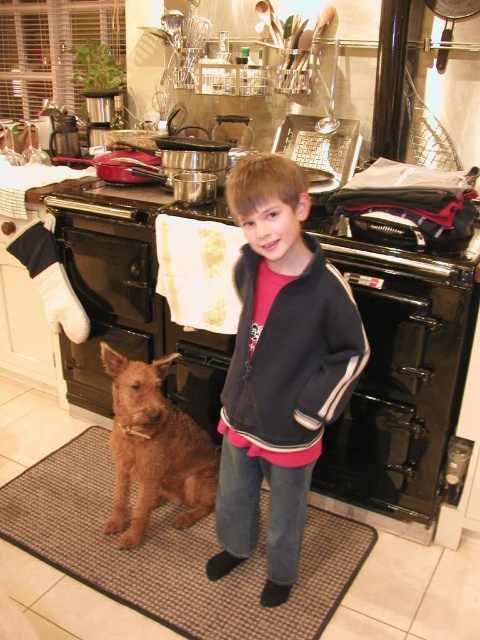
You are a delivery person who needs to place a package on the brown textured mat at center. However, there is a black fleece jacket at center in the way. Can you move the jacket to access the mat?

The black fleece jacket at center is in front of the brown textured mat at center, so you need to move the jacket to access the mat.

You are a delivery person who needs to place a small package on top of either the dark blue fleece sweatshirt at center or the shaggy brown dog at lower left. Which object can the package be placed on without exceeding its height?

The dark blue fleece sweatshirt at center is shorter than the shaggy brown dog at lower left, so the package should be placed on the shaggy brown dog at lower left to ensure it doesn not exceed its height.